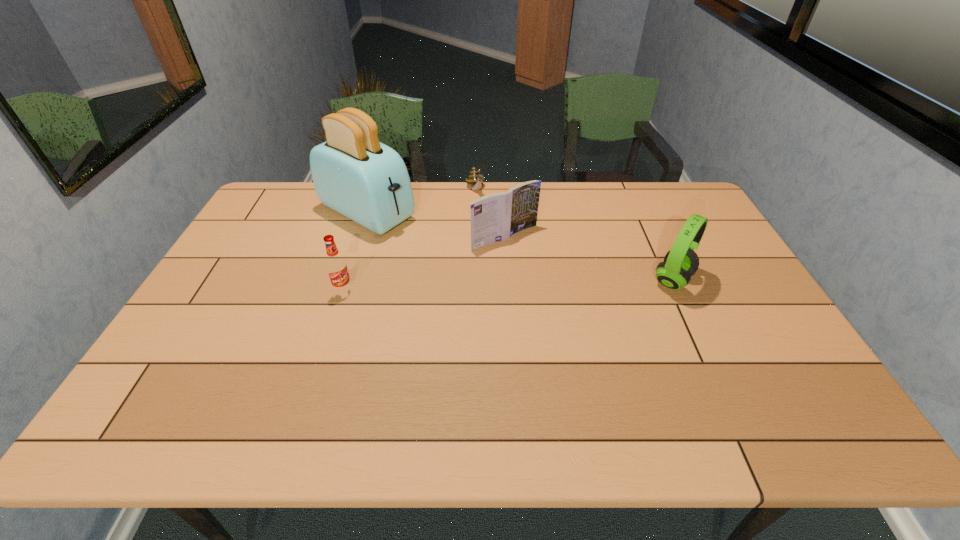
In the image, there is a desktop. Identify the location of free region at the near edge. Image resolution: width=960 pixels, height=540 pixels. (296, 362).

In the image, there is a desktop. In order to click on vacant space at the left edge in this screenshot , I will do `click(233, 258)`.

The height and width of the screenshot is (540, 960). In the image, there is a desktop. Identify the location of vacant space at the right edge. (735, 276).

In the image, there is a desktop. Where is `vacant space at the far left corner`? The image size is (960, 540). vacant space at the far left corner is located at coordinates (265, 202).

Locate an element on the screen. empty space that is in between the rightmost object and the root beer is located at coordinates (508, 285).

This screenshot has width=960, height=540. What are the coordinates of `vacant space that's between the snail and the headset` in the screenshot? It's located at (574, 235).

You are a GUI agent. You are given a task and a screenshot of the screen. Output one action in this format:
    pyautogui.click(x=<x>, y=<y>)
    Task: Click on the free point between the tallest object and the book
    This screenshot has height=540, width=960.
    Given the screenshot: What is the action you would take?
    pyautogui.click(x=436, y=225)

Identify the location of free space that is in between the shortest object and the rightmost object. The width and height of the screenshot is (960, 540). coord(574,235).

At what (x,y) coordinates should I click in order to perform the action: click on free space between the book and the root beer. Please return your answer as a coordinate pair (x, y). Looking at the image, I should click on (424, 264).

Locate an element on the screen. The height and width of the screenshot is (540, 960). vacant space that is in between the book and the rightmost object is located at coordinates (588, 259).